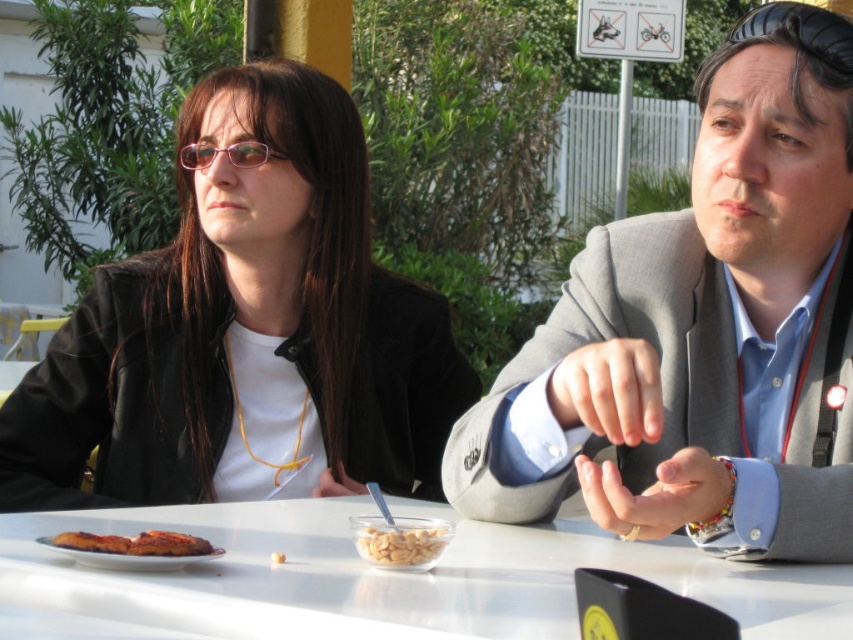
Question: Which point is farther to the camera?

Choices:
 (A) matte black jacket at left
 (B) pink plastic glasses at upper center
 (C) gray suit jacket at center

Answer: (B)

Question: Considering the relative positions of white glossy table at center and pink plastic glasses at upper center in the image provided, where is white glossy table at center located with respect to pink plastic glasses at upper center?

Choices:
 (A) left
 (B) right

Answer: (B)

Question: Which point is farther from the camera taking this photo?

Choices:
 (A) (59, 540)
 (B) (264, 154)
 (C) (695, 337)
 (D) (24, 452)

Answer: (B)

Question: Can you confirm if matte black jacket at left is positioned to the right of white glossy table at center?

Choices:
 (A) no
 (B) yes

Answer: (A)

Question: Does matte black jacket at left have a greater width compared to white glossy table at center?

Choices:
 (A) no
 (B) yes

Answer: (A)

Question: Which is nearer to the white matte cereal bowl at center?

Choices:
 (A) matte black jacket at left
 (B) white glossy table at center
 (C) gray suit jacket at center

Answer: (B)